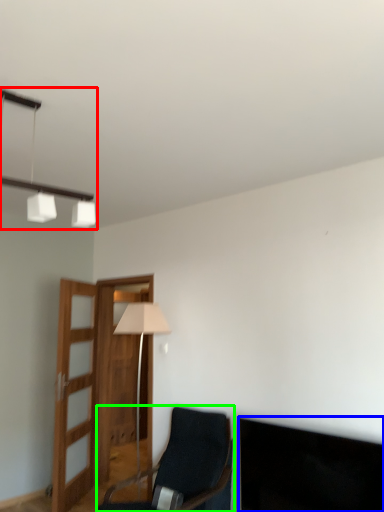
Question: Based on their relative distances, which object is nearer to lamp (highlighted by a red box)? Choose from dark (highlighted by a blue box) and chair (highlighted by a green box).

Choices:
 (A) dark
 (B) chair

Answer: (A)